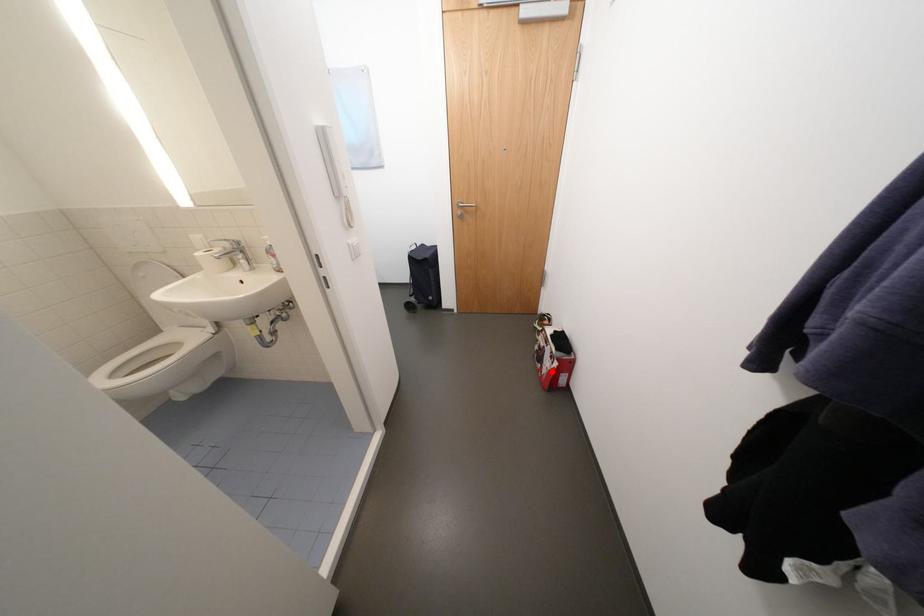
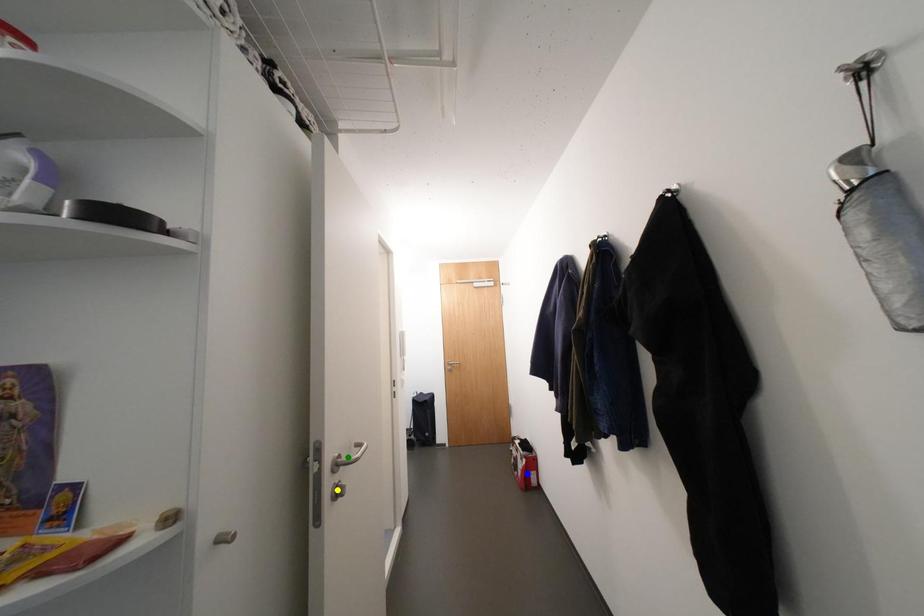
Question: I am providing you with two images of the same scene from different viewpoints. A red point is marked on the first image. You are given multiple points on the second image. Which mark in image 2 goes with the point in image 1?

Choices:
 (A) blue point
 (B) yellow point
 (C) green point

Answer: (A)